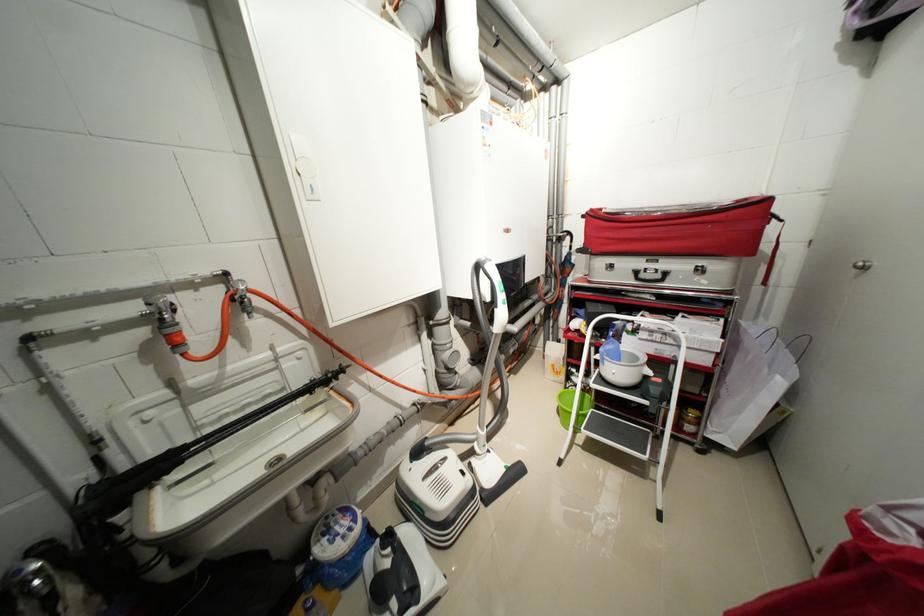
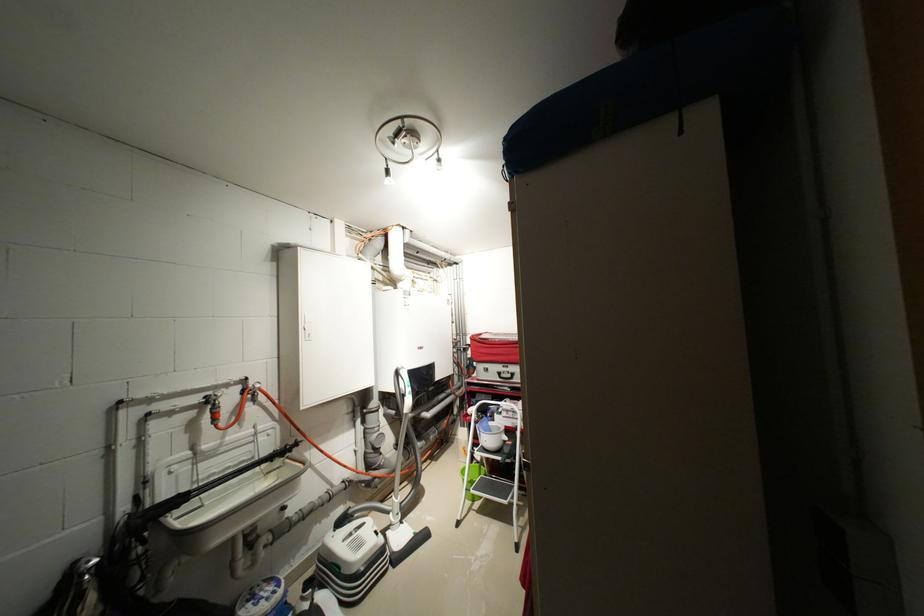
Locate, in the second image, the point that corresponds to pixel 556 225 in the first image.

(466, 341)